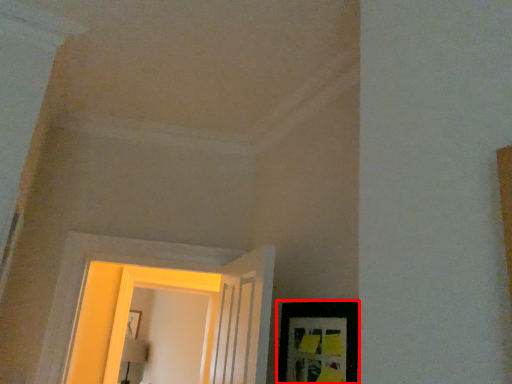
Question: Considering the relative positions of picture frame (annotated by the red box) and window in the image provided, where is picture frame (annotated by the red box) located with respect to the staircase?

Choices:
 (A) right
 (B) left

Answer: (A)